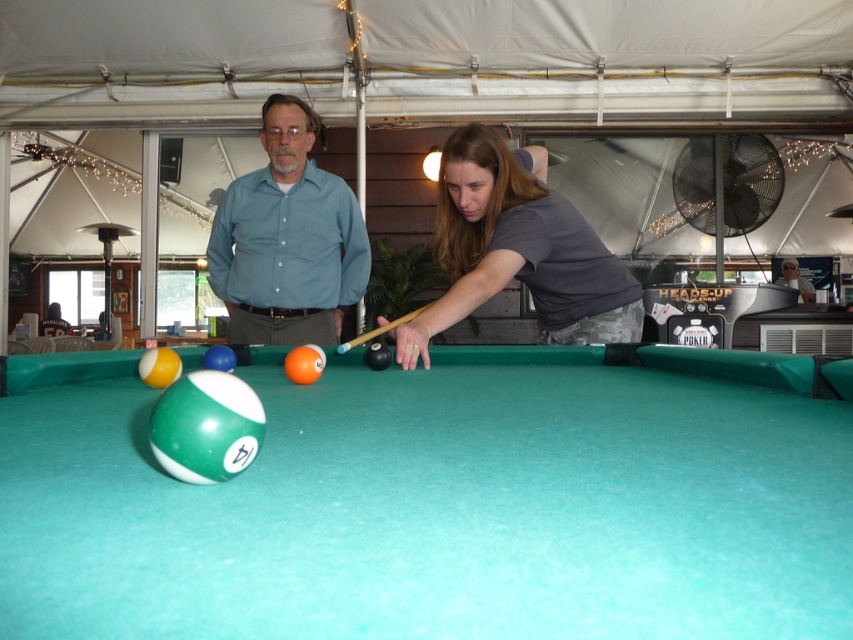
Between dark gray shirt at center and blue cotton shirt at center, which one is positioned lower?

Positioned lower is dark gray shirt at center.

Can you confirm if dark gray shirt at center is positioned to the left of blue cotton shirt at center?

No, dark gray shirt at center is not to the left of blue cotton shirt at center.

Which is in front, point (587, 227) or point (224, 205)?

Positioned in front is point (587, 227).

At what (x,y) coordinates should I click in order to perform the action: click on dark gray shirt at center. Please return your answer as a coordinate pair (x, y). The image size is (853, 640). Looking at the image, I should click on (518, 250).

Based on the photo, is green felt billiard table at center to the left of dark gray shirt at center from the viewer's perspective?

Correct, you'll find green felt billiard table at center to the left of dark gray shirt at center.

Is point (601, 400) positioned after point (404, 369)?

No, (601, 400) is in front of (404, 369).

Measure the distance between green felt billiard table at center and camera.

The distance of green felt billiard table at center from camera is 17.88 inches.

Locate an element on the screen. The height and width of the screenshot is (640, 853). green felt billiard table at center is located at coordinates (432, 504).

Looking at this image, is light blue shirt at center in front of wooden cue at center?

No.

Between light blue shirt at center and wooden cue at center, which one has more height?

light blue shirt at center

Which is behind, point (788, 262) or point (339, 346)?

The point (788, 262) is behind.

In order to click on light blue shirt at center in this screenshot , I will do `click(795, 280)`.